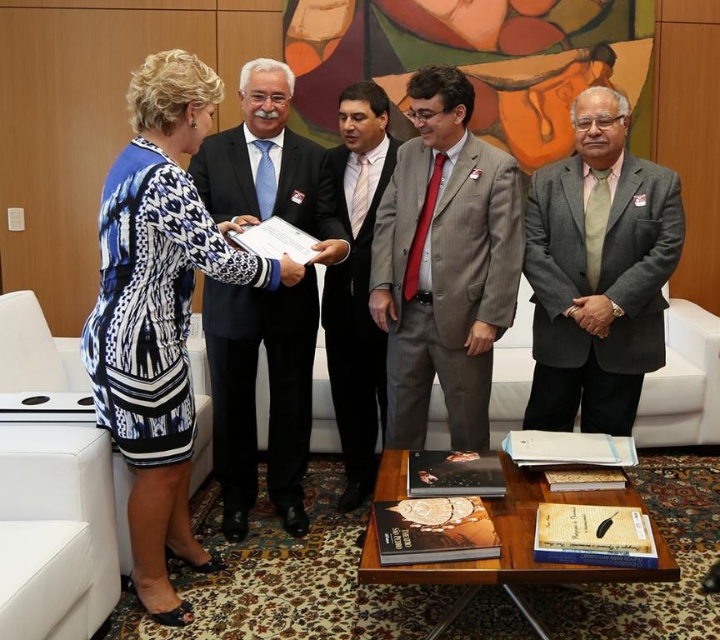
Question: Which point is closer to the camera taking this photo?

Choices:
 (A) (193, 182)
 (B) (492, 230)

Answer: (A)

Question: Is blue printed dress at left to the right of dark blue fabric business suit at center from the viewer's perspective?

Choices:
 (A) no
 (B) yes

Answer: (A)

Question: Based on their relative distances, which object is farther from the gray wool suit at right?

Choices:
 (A) gray pinstripe suit at center
 (B) gray wool suit at center
 (C) dark blue fabric business suit at center
 (D) blue printed dress at left

Answer: (D)

Question: Can you confirm if dark blue fabric business suit at center is thinner than gray wool suit at center?

Choices:
 (A) no
 (B) yes

Answer: (A)

Question: Considering the real-world distances, which object is closest to the blue printed dress at left?

Choices:
 (A) gray wool suit at right
 (B) gray pinstripe suit at center
 (C) dark blue fabric business suit at center

Answer: (C)

Question: Considering the relative positions of gray wool suit at right and gray wool suit at center in the image provided, where is gray wool suit at right located with respect to gray wool suit at center?

Choices:
 (A) below
 (B) above

Answer: (B)